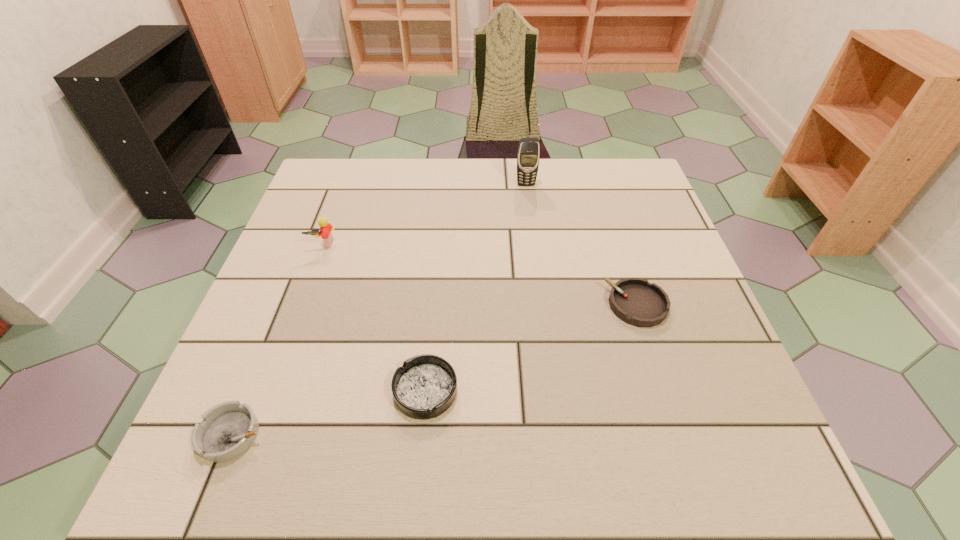
I want to click on cellular telephone, so click(x=528, y=156).

Where is `the tallest object`? The height and width of the screenshot is (540, 960). the tallest object is located at coordinates (528, 156).

Where is `the fourth shortest object`? The height and width of the screenshot is (540, 960). the fourth shortest object is located at coordinates (325, 228).

Where is `the fourth nearest object`? the fourth nearest object is located at coordinates (325, 228).

This screenshot has height=540, width=960. In order to click on the rightmost object in this screenshot , I will do `click(635, 301)`.

Where is `the third nearest object`? This screenshot has width=960, height=540. the third nearest object is located at coordinates (635, 301).

Where is `the second ashtray from right to left`? The image size is (960, 540). the second ashtray from right to left is located at coordinates (425, 387).

Find the location of a particular element. The image size is (960, 540). the leftmost ashtray is located at coordinates (228, 429).

Find the location of a particular element. Image resolution: width=960 pixels, height=540 pixels. free space located on the front face of the farthest object is located at coordinates (532, 228).

What are the coordinates of `vacant area situated 0.200m in front of the Lego with the accessory visible` in the screenshot? It's located at (297, 316).